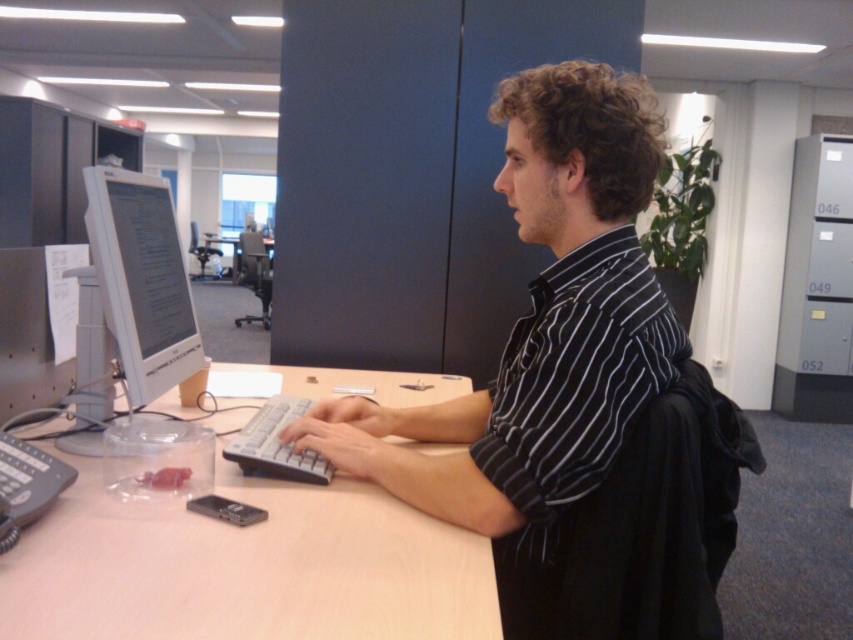
Who is higher up, black striped shirt at center or white plastic monitor at left?

Positioned higher is white plastic monitor at left.

Between black striped shirt at center and white plastic monitor at left, which one has less height?

Standing shorter between the two is white plastic monitor at left.

Between point (573, 636) and point (154, 224), which one is positioned behind?

The point (154, 224) is more distant.

Identify the location of black striped shirt at center. (563, 387).

Can you confirm if light brown wood computer desk at center is positioned below white plastic keyboard at center?

Yes.

Between light brown wood computer desk at center and white plastic keyboard at center, which one has more height?

light brown wood computer desk at center

The height and width of the screenshot is (640, 853). Find the location of `light brown wood computer desk at center`. light brown wood computer desk at center is located at coordinates (245, 566).

Does light brown wood computer desk at center have a greater width compared to wooden desk at center?

No.

Does point (300, 515) come farther from viewer compared to point (236, 262)?

No.

Between point (384, 564) and point (236, 275), which one is positioned behind?

The point (236, 275) is more distant.

Image resolution: width=853 pixels, height=640 pixels. What are the coordinates of `light brown wood computer desk at center` in the screenshot? It's located at (245, 566).